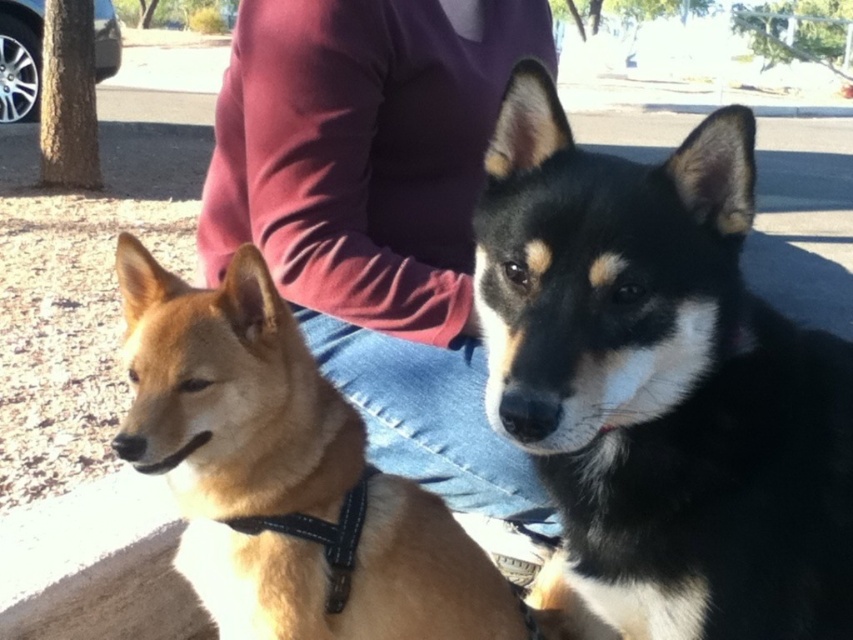
Question: Which of the following is the closest to the observer?

Choices:
 (A) golden fur dog at center
 (B) black fur dog at center
 (C) purple fabric shirt at upper center

Answer: (B)

Question: Does golden fur dog at center appear under black fabric neckband at lower left?

Choices:
 (A) no
 (B) yes

Answer: (A)

Question: Which point is farther to the camera?

Choices:
 (A) black fabric neckband at lower left
 (B) black fur dog at center
 (C) golden fur dog at center
 (D) purple fabric shirt at upper center

Answer: (D)

Question: Which object appears closest to the camera in this image?

Choices:
 (A) black fur dog at center
 (B) golden fur dog at center
 (C) black fabric neckband at lower left
 (D) purple fabric shirt at upper center

Answer: (A)

Question: Can you confirm if black fur dog at center is wider than black fabric neckband at lower left?

Choices:
 (A) no
 (B) yes

Answer: (B)

Question: Does black fur dog at center lie in front of black fabric neckband at lower left?

Choices:
 (A) no
 (B) yes

Answer: (B)